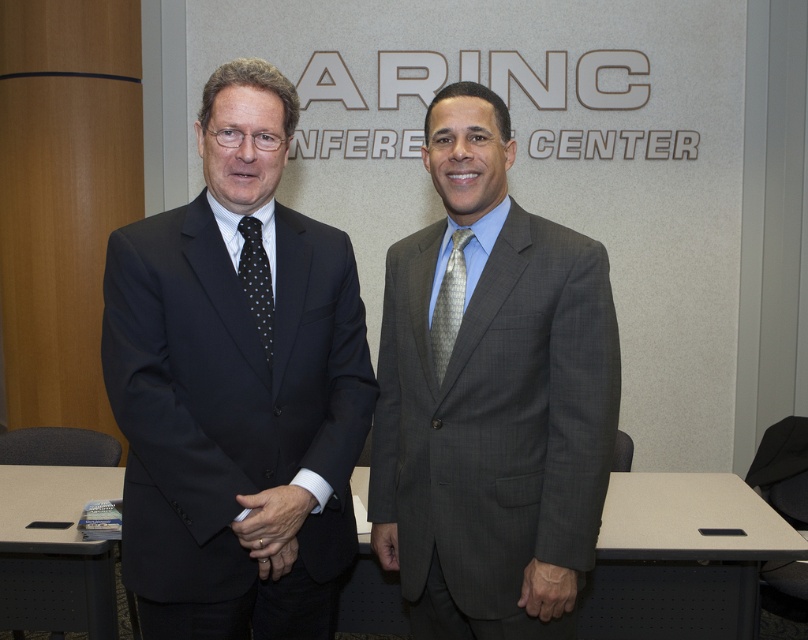
Is point (432, 336) in front of point (264, 320)?

No, it is behind (264, 320).

Which of these two, gray textured tie at center or black dotted tie at center, stands shorter?

Standing shorter between the two is black dotted tie at center.

Is point (451, 260) more distant than point (259, 301)?

Yes, point (451, 260) is behind point (259, 301).

Where is `gray textured tie at center`? gray textured tie at center is located at coordinates (448, 304).

Who is more distant from viewer, (470, 528) or (452, 252)?

The point (452, 252) is more distant.

Does gray textured suit at center appear on the left side of gray textured tie at center?

No, gray textured suit at center is not to the left of gray textured tie at center.

Describe the element at coordinates (490, 396) in the screenshot. This screenshot has width=808, height=640. I see `gray textured suit at center` at that location.

The height and width of the screenshot is (640, 808). What are the coordinates of `gray textured suit at center` in the screenshot? It's located at (490, 396).

Does gray textured suit at center appear over black dotted tie at center?

Incorrect, gray textured suit at center is not positioned above black dotted tie at center.

Who is taller, gray textured suit at center or black dotted tie at center?

Standing taller between the two is gray textured suit at center.

Between point (470, 442) and point (243, 252), which one is positioned in front?

Positioned in front is point (470, 442).

The width and height of the screenshot is (808, 640). Find the location of `gray textured suit at center`. gray textured suit at center is located at coordinates (490, 396).